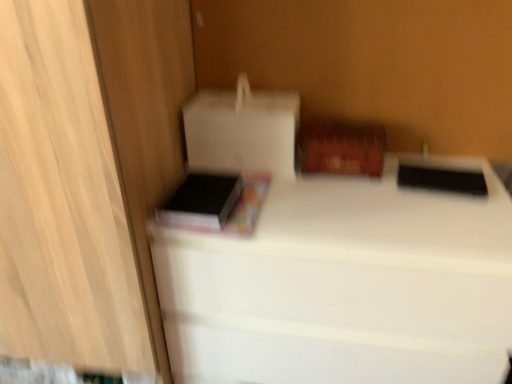
This screenshot has height=384, width=512. Identify the location of unoccupied region to the right of black matte book at left. (277, 203).